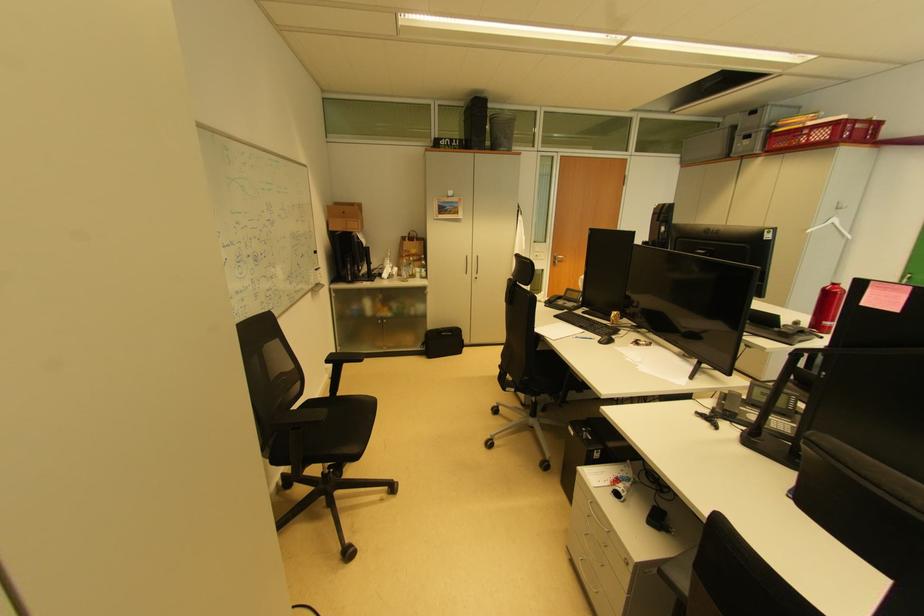
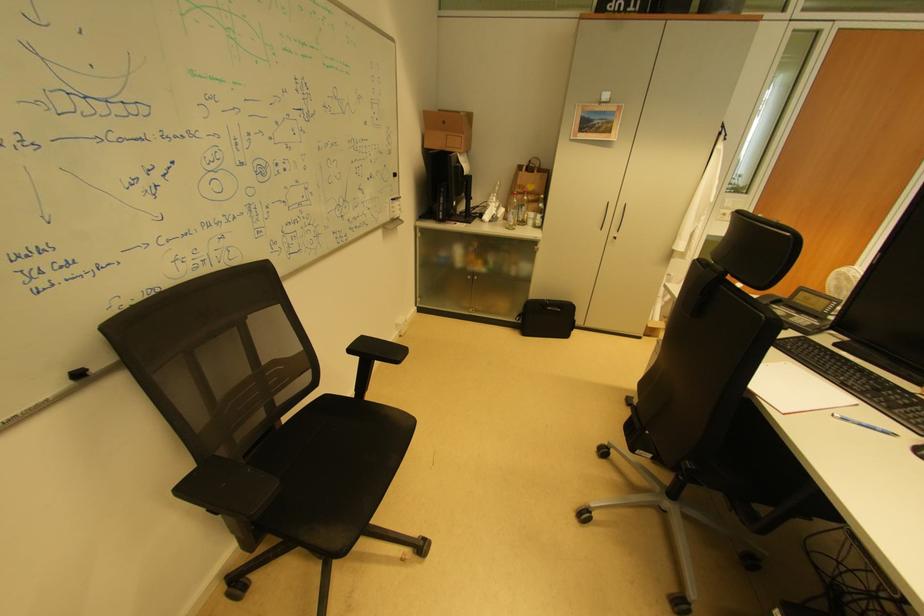
Question: Which direction would the cameraman need to move to produce the second image? Reply with the corresponding letter.

Choices:
 (A) Left
 (B) Right
 (C) Forward
 (D) Backward

Answer: (C)